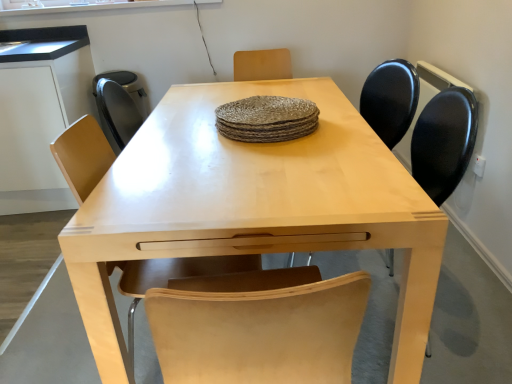
Question: Is matte black chair at center, the first chair viewed from the right, in front of or behind matte black computer desk at left in the image?

Choices:
 (A) behind
 (B) front

Answer: (B)

Question: In terms of height, does matte black chair at center, the first chair viewed from the right, look taller or shorter compared to matte black computer desk at left?

Choices:
 (A) tall
 (B) short

Answer: (B)

Question: Which object is positioned farthest from the matte black computer desk at left?

Choices:
 (A) light brown wood chair at center, the first chair from the left
 (B) rustic woven placemat at center
 (C) light wood table at center
 (D) matte black chair at center, the first chair viewed from the right

Answer: (D)

Question: Considering the real-world distances, which object is closest to the matte black computer desk at left?

Choices:
 (A) rustic woven placemat at center
 (B) matte black chair at center, the first chair viewed from the right
 (C) light brown wood chair at center, the 2th chair in the right-to-left sequence
 (D) light wood table at center

Answer: (D)